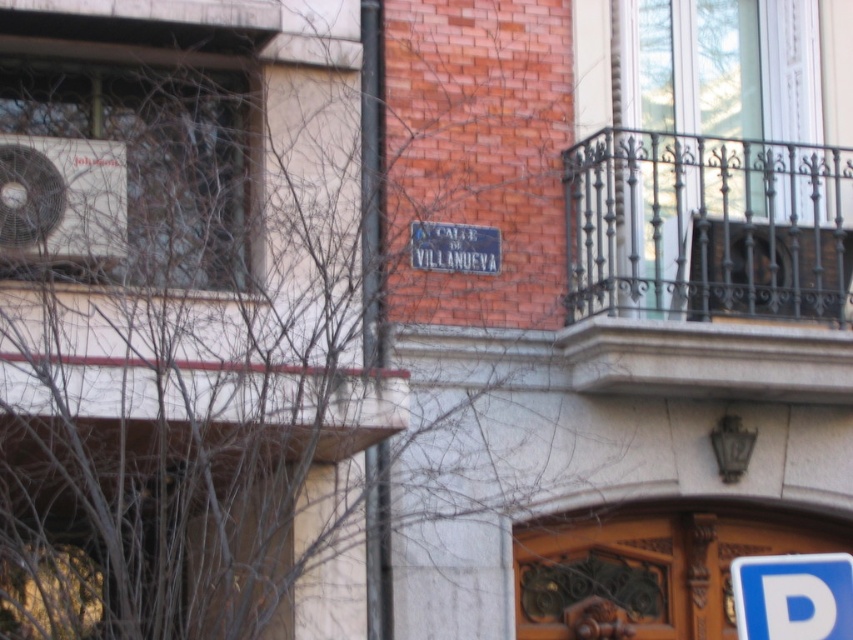
Question: Can you confirm if black wrought iron balcony at upper right is positioned to the right of blue plastic parking sign at lower right?

Choices:
 (A) no
 (B) yes

Answer: (B)

Question: Does matte black air conditioner at upper left appear under blue plastic parking sign at lower right?

Choices:
 (A) yes
 (B) no

Answer: (B)

Question: In this image, where is matte black air conditioner at upper left located relative to blue plastic parking sign at lower right?

Choices:
 (A) right
 (B) left

Answer: (B)

Question: Which of the following is the farthest from the observer?

Choices:
 (A) matte black air conditioner at upper left
 (B) blue plastic parking sign at lower right

Answer: (A)

Question: Among these points, which one is nearest to the camera?

Choices:
 (A) (805, 202)
 (B) (805, 570)

Answer: (B)

Question: Estimate the real-world distances between objects in this image. Which object is farther from the matte black air conditioner at upper left?

Choices:
 (A) black wrought iron balcony at upper right
 (B) blue plastic parking sign at lower right

Answer: (B)